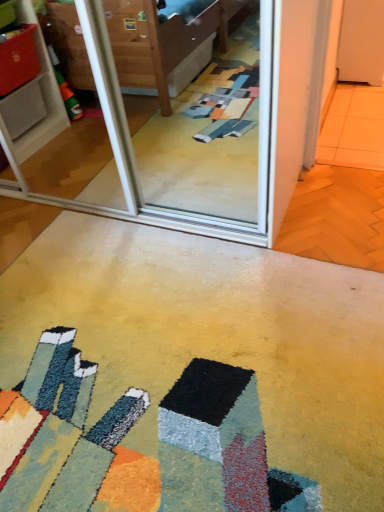
Question: Is transparent glass screen door at upper center surrounding carpeted floor at center?

Choices:
 (A) no
 (B) yes

Answer: (A)

Question: Can you confirm if transparent glass screen door at upper center is wider than carpeted floor at center?

Choices:
 (A) yes
 (B) no

Answer: (B)

Question: Is transparent glass screen door at upper center not inside carpeted floor at center?

Choices:
 (A) yes
 (B) no

Answer: (A)

Question: Considering the relative positions of transparent glass screen door at upper center and carpeted floor at center in the image provided, is transparent glass screen door at upper center behind carpeted floor at center?

Choices:
 (A) no
 (B) yes

Answer: (B)

Question: Does transparent glass screen door at upper center touch carpeted floor at center?

Choices:
 (A) yes
 (B) no

Answer: (B)

Question: Considering the relative sizes of transparent glass screen door at upper center and carpeted floor at center in the image provided, is transparent glass screen door at upper center thinner than carpeted floor at center?

Choices:
 (A) yes
 (B) no

Answer: (A)

Question: Is carpeted floor at center at the right side of transparent glass screen door at upper center?

Choices:
 (A) no
 (B) yes

Answer: (B)

Question: From a real-world perspective, is carpeted floor at center physically below transparent glass screen door at upper center?

Choices:
 (A) no
 (B) yes

Answer: (B)

Question: From the image's perspective, is carpeted floor at center on top of transparent glass screen door at upper center?

Choices:
 (A) no
 (B) yes

Answer: (A)

Question: From the image's perspective, would you say carpeted floor at center is shown under transparent glass screen door at upper center?

Choices:
 (A) yes
 (B) no

Answer: (A)

Question: Does carpeted floor at center have a greater width compared to transparent glass screen door at upper center?

Choices:
 (A) no
 (B) yes

Answer: (B)

Question: Considering the relative sizes of carpeted floor at center and transparent glass screen door at upper center in the image provided, is carpeted floor at center taller than transparent glass screen door at upper center?

Choices:
 (A) no
 (B) yes

Answer: (A)

Question: From a real-world perspective, is carpeted floor at center positioned above or below transparent glass screen door at upper center?

Choices:
 (A) above
 (B) below

Answer: (B)